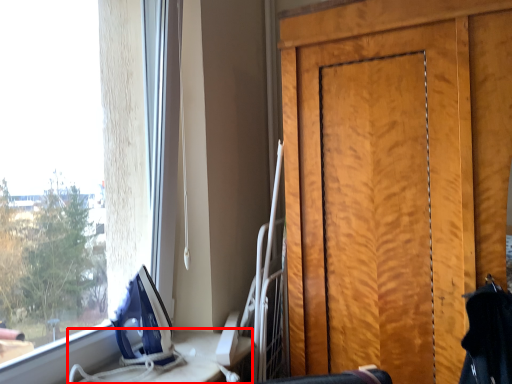
Question: From the image's perspective, where is table (annotated by the red box) located relative to door?

Choices:
 (A) below
 (B) above

Answer: (A)